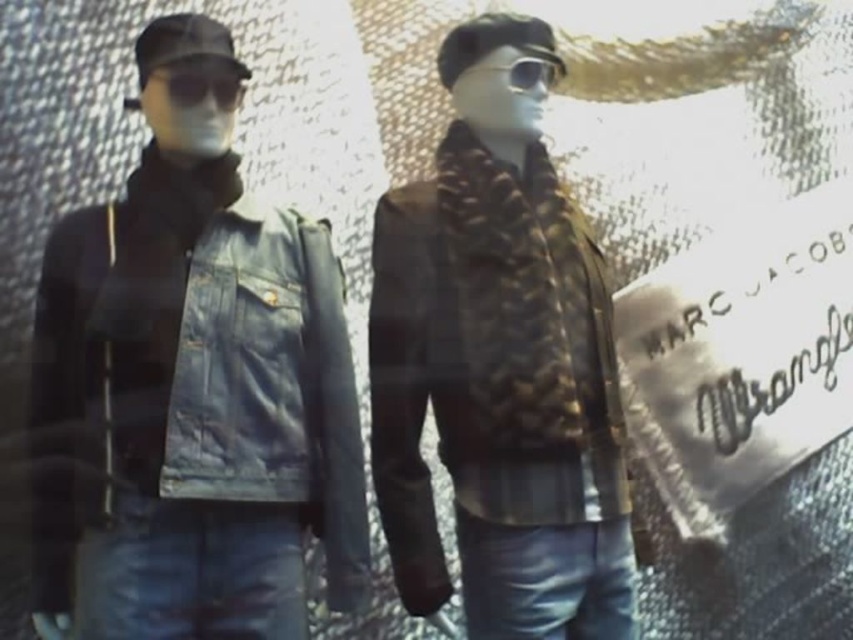
Question: Which point is closer to the camera?

Choices:
 (A) leather jacket at center
 (B) matte black goggles at left
 (C) clear plastic goggles at center

Answer: (B)

Question: Which is farther from the leather jacket at left?

Choices:
 (A) matte black goggles at left
 (B) leather jacket at center

Answer: (A)

Question: Which object is the farthest from the leather jacket at center?

Choices:
 (A) clear plastic goggles at center
 (B) matte black goggles at left
 (C) leather jacket at left

Answer: (B)

Question: Does leather jacket at center have a smaller size compared to leather jacket at left?

Choices:
 (A) no
 (B) yes

Answer: (A)

Question: Is leather jacket at center smaller than matte black goggles at left?

Choices:
 (A) yes
 (B) no

Answer: (B)

Question: In this image, where is leather jacket at left located relative to matte black goggles at left?

Choices:
 (A) below
 (B) above

Answer: (A)